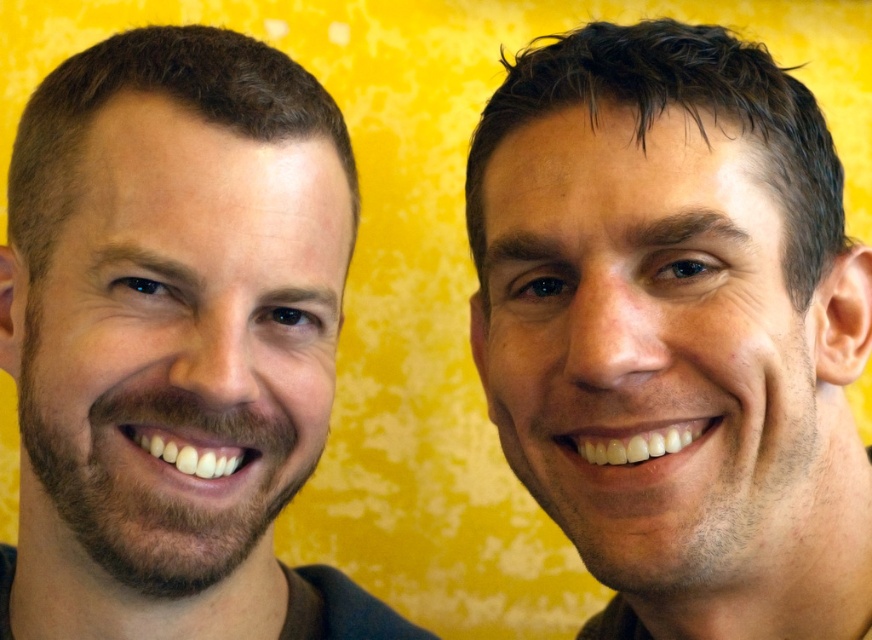
Question: Which object appears closest to the camera in this image?

Choices:
 (A) smooth skin face at center
 (B) brown hair at left

Answer: (A)

Question: Can you confirm if smooth skin face at center is positioned to the right of brown hair at left?

Choices:
 (A) no
 (B) yes

Answer: (B)

Question: Does smooth skin face at center have a greater width compared to brown hair at left?

Choices:
 (A) yes
 (B) no

Answer: (B)

Question: Among these objects, which one is nearest to the camera?

Choices:
 (A) brown hair at left
 (B) smooth skin face at center

Answer: (B)

Question: Which point is farther to the camera?

Choices:
 (A) (285, 634)
 (B) (645, 396)

Answer: (A)

Question: Can you confirm if smooth skin face at center is smaller than brown hair at left?

Choices:
 (A) no
 (B) yes

Answer: (A)